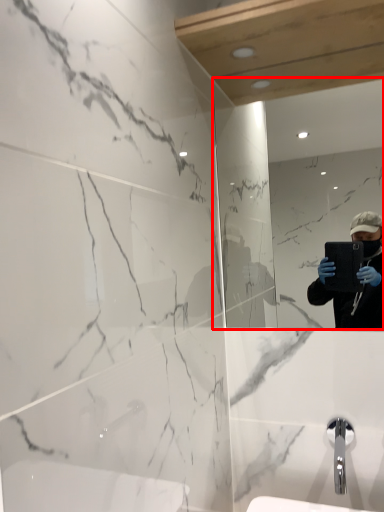
Question: From the image's perspective, considering the relative positions of mirror (annotated by the red box) and tap in the image provided, where is mirror (annotated by the red box) located with respect to the staircase?

Choices:
 (A) below
 (B) above

Answer: (B)